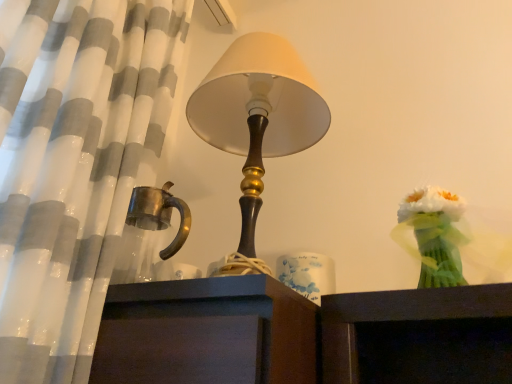
Question: Is white ceramic candle holder at center located within white silk bouquet at right?

Choices:
 (A) no
 (B) yes

Answer: (A)

Question: Does white silk bouquet at right have a lesser width compared to white ceramic candle holder at center?

Choices:
 (A) yes
 (B) no

Answer: (B)

Question: Is white silk bouquet at right bigger than white ceramic candle holder at center?

Choices:
 (A) no
 (B) yes

Answer: (B)

Question: Is white silk bouquet at right positioned with its back to white ceramic candle holder at center?

Choices:
 (A) no
 (B) yes

Answer: (A)

Question: From a real-world perspective, does white silk bouquet at right sit lower than white ceramic candle holder at center?

Choices:
 (A) yes
 (B) no

Answer: (B)

Question: Can you confirm if white silk bouquet at right is positioned to the right of white ceramic candle holder at center?

Choices:
 (A) yes
 (B) no

Answer: (A)

Question: Considering the relative positions of white ceramic candle holder at center and white silk bouquet at right in the image provided, is white ceramic candle holder at center to the left of white silk bouquet at right from the viewer's perspective?

Choices:
 (A) no
 (B) yes

Answer: (B)

Question: Does white ceramic candle holder at center have a lesser width compared to white silk bouquet at right?

Choices:
 (A) no
 (B) yes

Answer: (B)

Question: From the image's perspective, is white ceramic candle holder at center beneath white silk bouquet at right?

Choices:
 (A) no
 (B) yes

Answer: (B)

Question: Is white ceramic candle holder at center smaller than white silk bouquet at right?

Choices:
 (A) no
 (B) yes

Answer: (B)

Question: Does white ceramic candle holder at center have a greater width compared to white silk bouquet at right?

Choices:
 (A) yes
 (B) no

Answer: (B)

Question: Is the depth of white ceramic candle holder at center less than that of white silk bouquet at right?

Choices:
 (A) yes
 (B) no

Answer: (B)

Question: Is point (305, 281) closer or farther from the camera than point (417, 190)?

Choices:
 (A) closer
 (B) farther

Answer: (B)